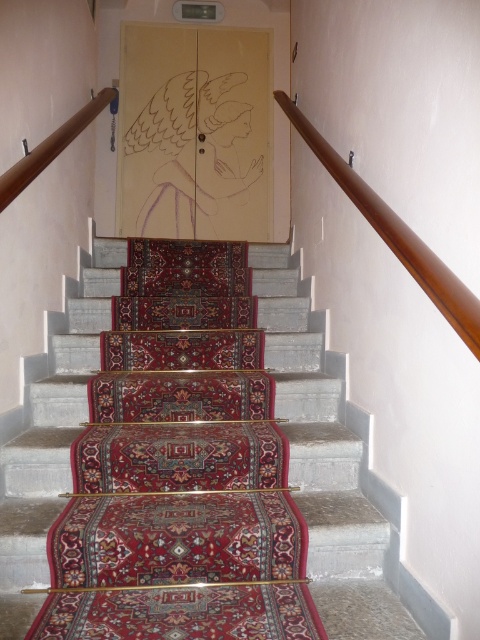
You are standing at the bottom of the staircase and want to reach the door at the top. Which handrail should you hold onto if you prefer a wider grip? Please choose between the wooden handrail at upper right and the brown wooden handrail at upper left.

The wooden handrail at upper right is larger in size than the brown wooden handrail at upper left, so you should hold onto the wooden handrail at upper right for a wider grip.